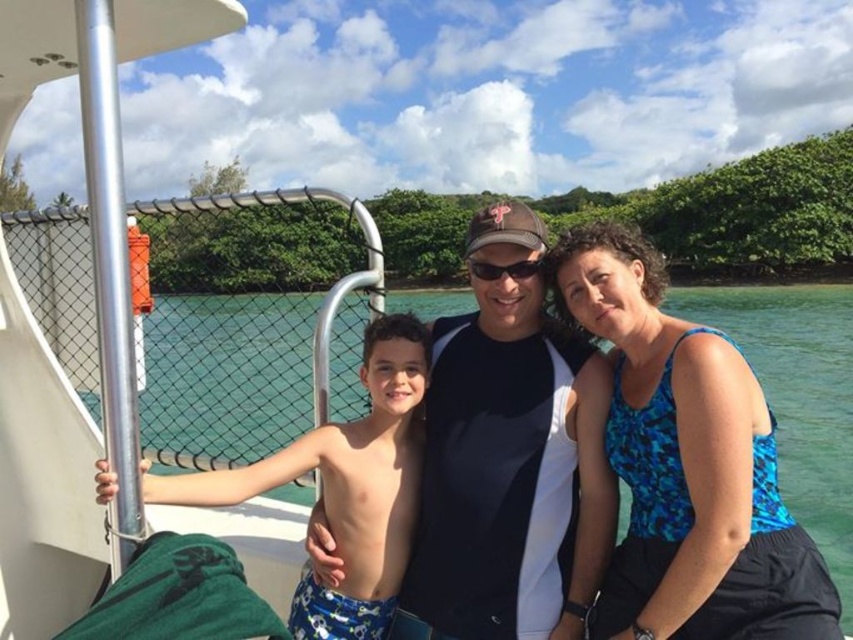
Question: Which point is closer to the camera taking this photo?

Choices:
 (A) (663, 369)
 (B) (450, 451)

Answer: (A)

Question: Based on their relative distances, which object is nearer to the blue printed swim trunks at left?

Choices:
 (A) blue printed tank top at center
 (B) black fabric shirt at center

Answer: (B)

Question: Considering the real-world distances, which object is closest to the blue printed tank top at center?

Choices:
 (A) black fabric shirt at center
 (B) blue printed swim trunks at left

Answer: (A)

Question: Does black fabric shirt at center appear on the right side of blue printed swim trunks at left?

Choices:
 (A) no
 (B) yes

Answer: (B)

Question: Observing the image, what is the correct spatial positioning of black fabric shirt at center in reference to blue printed tank top at center?

Choices:
 (A) right
 (B) left

Answer: (B)

Question: Can you confirm if black fabric shirt at center is positioned above blue printed swim trunks at left?

Choices:
 (A) yes
 (B) no

Answer: (A)